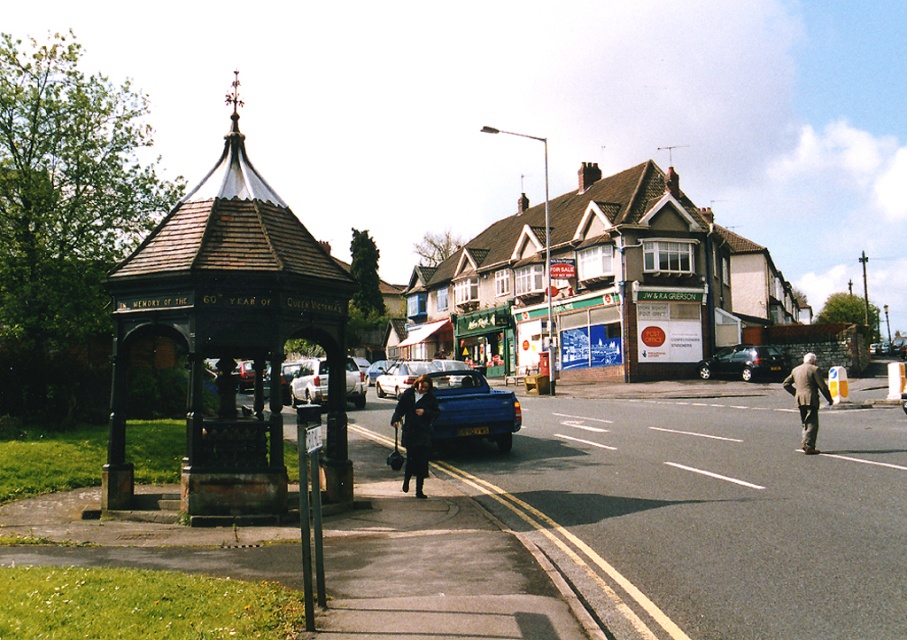
Question: Observing the image, what is the correct spatial positioning of wooden gazebo at left in reference to dark blue coat at center?

Choices:
 (A) left
 (B) right

Answer: (A)

Question: Which point appears farthest from the camera in this image?

Choices:
 (A) (397, 385)
 (B) (820, 388)

Answer: (A)

Question: Does shiny black car at center have a larger size compared to silver metallic car at center?

Choices:
 (A) no
 (B) yes

Answer: (A)

Question: Based on their relative distances, which object is farther from the metallic blue pickup truck at center?

Choices:
 (A) dark blue coat at center
 (B) silver metallic car at center
 (C) shiny black car at center

Answer: (A)

Question: Is brown brick building at center positioned at the back of shiny black car at center?

Choices:
 (A) no
 (B) yes

Answer: (A)

Question: Which point appears closest to the camera in this image?

Choices:
 (A) (707, 368)
 (B) (815, 420)
 (C) (587, 195)
 (D) (408, 436)

Answer: (D)